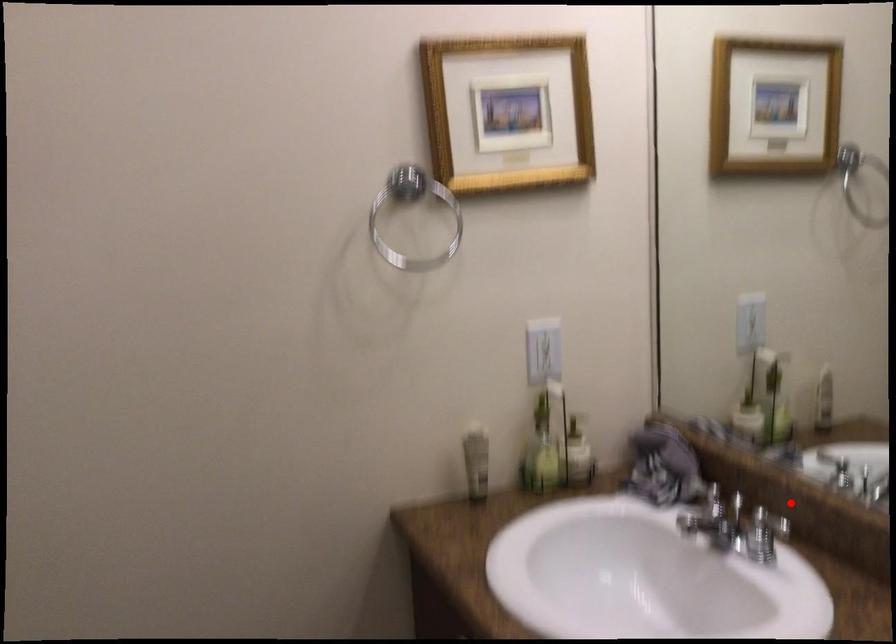
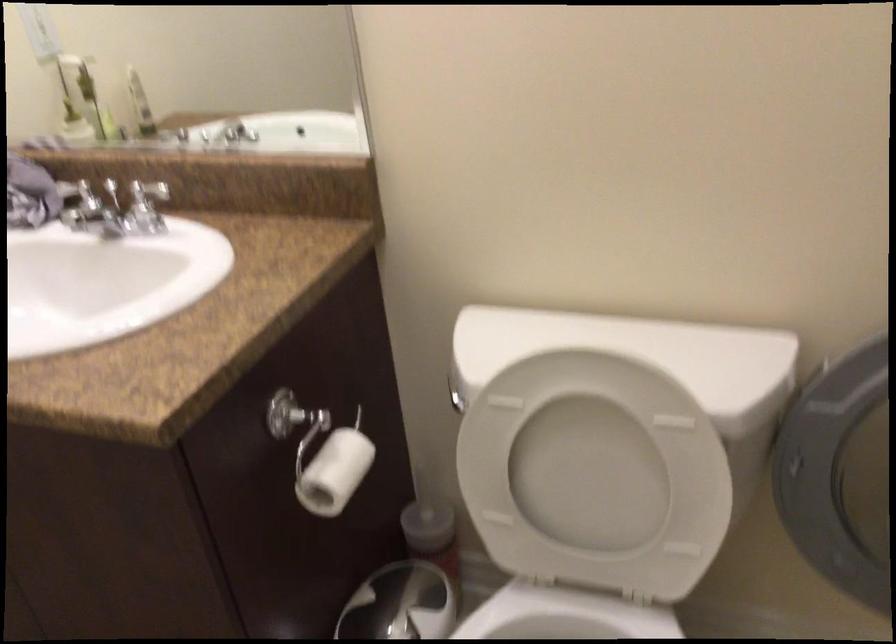
The point at the highlighted location is marked in the first image. Where is the corresponding point in the second image?

(156, 182)